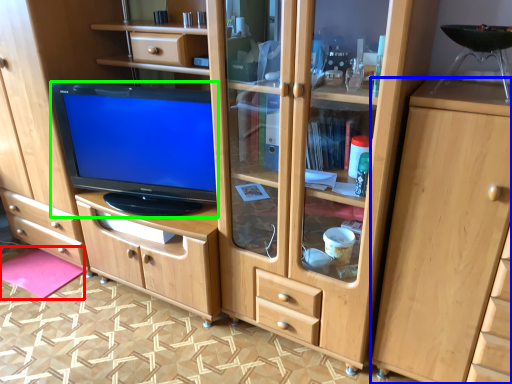
Question: Which is nearer to the flat (highlighted by a red box)? cabinetry (highlighted by a blue box) or television (highlighted by a green box).

Choices:
 (A) cabinetry
 (B) television

Answer: (B)